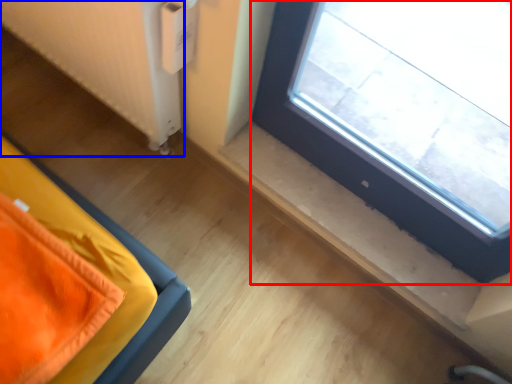
Question: Which object is closer to the camera taking this photo, window (highlighted by a red box) or radiator (highlighted by a blue box)?

Choices:
 (A) window
 (B) radiator

Answer: (A)